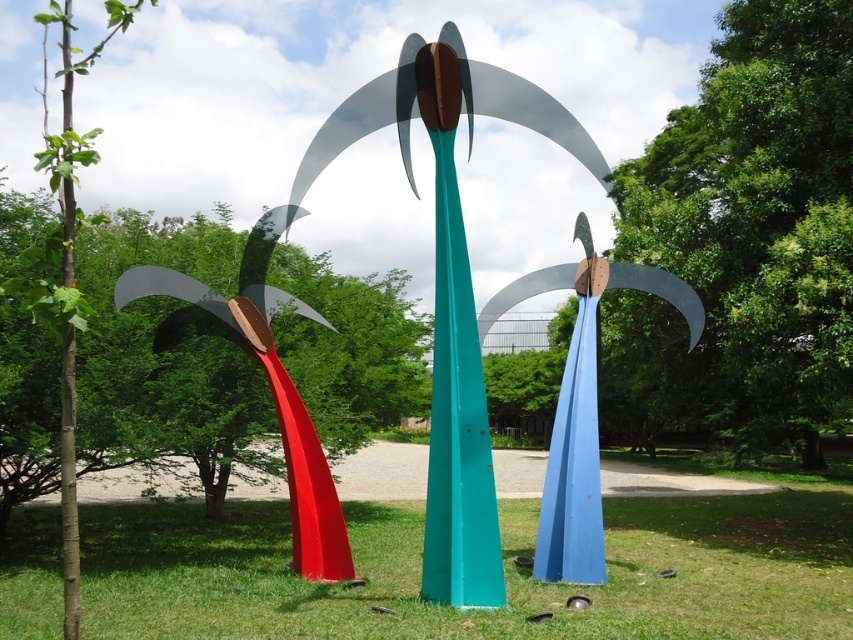
Is metallic red palm tree at left bigger than teal glossy pole at center?

Indeed, metallic red palm tree at left has a larger size compared to teal glossy pole at center.

Who is lower down, metallic red palm tree at left or teal glossy pole at center?

teal glossy pole at center is below.

Between point (361, 294) and point (440, 131), which one is positioned behind?

The point (361, 294) is behind.

Locate an element on the screen. This screenshot has width=853, height=640. metallic red palm tree at left is located at coordinates (165, 362).

Where is `green grass at center`? The image size is (853, 640). green grass at center is located at coordinates (505, 572).

Is point (155, 564) positioned behind point (456, 193)?

Yes, it is behind point (456, 193).

What do you see at coordinates (505, 572) in the screenshot?
I see `green grass at center` at bounding box center [505, 572].

The width and height of the screenshot is (853, 640). In order to click on green grass at center in this screenshot , I will do `click(505, 572)`.

Which is behind, point (316, 371) or point (297, 433)?

The point (316, 371) is behind.

Image resolution: width=853 pixels, height=640 pixels. Find the location of `metallic red palm tree at left`. metallic red palm tree at left is located at coordinates (165, 362).

Where is `metallic red palm tree at left`? The image size is (853, 640). metallic red palm tree at left is located at coordinates (165, 362).